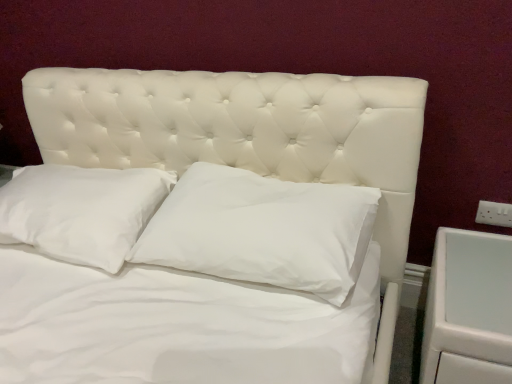
In order to face white soft pillow at center, acting as the 1th pillow starting from the left, should I rotate leftwards or rightwards?

To face it directly, rotate left by 24.126 degrees.

This screenshot has width=512, height=384. Describe the element at coordinates (262, 230) in the screenshot. I see `white cotton pillow at center, which ranks as the first pillow in right-to-left order` at that location.

In order to face white plastic electric outlet at right, should I rotate leftwards or rightwards?

To align with it, rotate right about 29.883°.

This screenshot has width=512, height=384. What do you see at coordinates (468, 309) in the screenshot?
I see `white glossy drawer at right` at bounding box center [468, 309].

Identify the location of white soft pillow at center, arranged as the 2th pillow when viewed from the right. This screenshot has height=384, width=512. (81, 211).

Is white glossy drawer at right further to camera compared to white soft pillow at center, acting as the 1th pillow starting from the left?

That is False.

Which point is more distant from viewer, (455, 276) or (82, 212)?

The point (82, 212) is behind.

From a real-world perspective, is white glossy drawer at right located beneath white soft pillow at center, arranged as the 2th pillow when viewed from the right?

Indeed, from a real-world perspective, white glossy drawer at right is positioned beneath white soft pillow at center, arranged as the 2th pillow when viewed from the right.

In the scene shown: Measure the distance from white glossy drawer at right to white soft pillow at center, arranged as the 2th pillow when viewed from the right.

white glossy drawer at right and white soft pillow at center, arranged as the 2th pillow when viewed from the right, are 3.38 feet apart from each other.

From the image's perspective, which one is positioned higher, white cotton pillow at center, which ranks as the first pillow in right-to-left order, or white plastic electric outlet at right?

white plastic electric outlet at right is shown above in the image.

How different are the orientations of white cotton pillow at center, which is the second pillow from left to right, and white plastic electric outlet at right in degrees?

They differ by 1.69 degrees in their facing directions.

Would you consider white cotton pillow at center, which is the second pillow from left to right, to be distant from white plastic electric outlet at right?

No, white cotton pillow at center, which is the second pillow from left to right, is not far from white plastic electric outlet at right.

Does point (366, 201) come in front of point (504, 203)?

Yes, it is.

Between white plastic electric outlet at right and white glossy drawer at right, which one has smaller width?

white plastic electric outlet at right is thinner.

Looking at this image, would you say white glossy drawer at right is part of white plastic electric outlet at right's contents?

Result: No, white glossy drawer at right is located outside of white plastic electric outlet at right.

Does white plastic electric outlet at right have a greater height compared to white glossy drawer at right?

Incorrect, the height of white plastic electric outlet at right is not larger of that of white glossy drawer at right.

From a real-world perspective, who is located higher, white plastic electric outlet at right or white glossy drawer at right?

From a 3D spatial view, white plastic electric outlet at right is above.

From a real-world perspective, between white soft pillow at center, acting as the 1th pillow starting from the left, and white glossy drawer at right, who is vertically higher?

white soft pillow at center, acting as the 1th pillow starting from the left, from a real-world perspective.

Based on the photo, is there a large distance between white soft pillow at center, arranged as the 2th pillow when viewed from the right, and white glossy drawer at right?

white soft pillow at center, arranged as the 2th pillow when viewed from the right, is far away from white glossy drawer at right.

Between white soft pillow at center, arranged as the 2th pillow when viewed from the right, and white glossy drawer at right, which one has more height?

white glossy drawer at right.

Considering the positions of points (152, 204) and (456, 339), is point (152, 204) closer to camera compared to point (456, 339)?

No.

Relative to white plastic electric outlet at right, is white glossy drawer at right in front or behind?

In the image, white glossy drawer at right appears in front of white plastic electric outlet at right.

Is white glossy drawer at right positioned far away from white plastic electric outlet at right?

No, white glossy drawer at right is not far from white plastic electric outlet at right.

Identify the location of dresser below the white plastic electric outlet at right (from a real-world perspective). The height and width of the screenshot is (384, 512). (468, 309).

How many degrees apart are the facing directions of white glossy drawer at right and white plastic electric outlet at right?

0.925 degrees separate the facing orientations of white glossy drawer at right and white plastic electric outlet at right.

Is point (118, 214) positioned after point (162, 229)?

Yes.

Which object is further away from the camera taking this photo, white soft pillow at center, acting as the 1th pillow starting from the left, or white cotton pillow at center, which ranks as the first pillow in right-to-left order?

white soft pillow at center, acting as the 1th pillow starting from the left, is further away from the camera.

From a real-world perspective, does white soft pillow at center, acting as the 1th pillow starting from the left, stand above white cotton pillow at center, which is the second pillow from left to right?

No, from a real-world perspective, white soft pillow at center, acting as the 1th pillow starting from the left, is not above white cotton pillow at center, which is the second pillow from left to right.

From the image's perspective, would you say white cotton pillow at center, which is the second pillow from left to right, is shown under white glossy drawer at right?

Incorrect, from the image's perspective, white cotton pillow at center, which is the second pillow from left to right, is higher than white glossy drawer at right.

Considering the sizes of objects white cotton pillow at center, which ranks as the first pillow in right-to-left order, and white glossy drawer at right in the image provided, who is smaller, white cotton pillow at center, which ranks as the first pillow in right-to-left order, or white glossy drawer at right?

With smaller size is white cotton pillow at center, which ranks as the first pillow in right-to-left order.

Is white cotton pillow at center, which ranks as the first pillow in right-to-left order, situated inside white glossy drawer at right or outside?

white cotton pillow at center, which ranks as the first pillow in right-to-left order, cannot be found inside white glossy drawer at right.

Who is taller, white cotton pillow at center, which ranks as the first pillow in right-to-left order, or white glossy drawer at right?

Standing taller between the two is white glossy drawer at right.

From a real-world perspective, which pillow is the 1st one above the white glossy drawer at right? Please provide its 2D coordinates.

[(81, 211)]

Where is `electric outlet behind the white cotton pillow at center, which is the second pillow from left to right`? The height and width of the screenshot is (384, 512). electric outlet behind the white cotton pillow at center, which is the second pillow from left to right is located at coordinates (494, 214).

Which object lies further to the anchor point white soft pillow at center, arranged as the 2th pillow when viewed from the right, white cotton pillow at center, which is the second pillow from left to right, or white glossy drawer at right?

Among the two, white glossy drawer at right is located further to white soft pillow at center, arranged as the 2th pillow when viewed from the right.

Estimate the real-world distances between objects in this image. Which object is closer to white cotton pillow at center, which ranks as the first pillow in right-to-left order, white soft pillow at center, arranged as the 2th pillow when viewed from the right, or white plastic electric outlet at right?

white soft pillow at center, arranged as the 2th pillow when viewed from the right, is closer to white cotton pillow at center, which ranks as the first pillow in right-to-left order.

Looking at this image, when comparing their distances from white cotton pillow at center, which is the second pillow from left to right, does white plastic electric outlet at right or white soft pillow at center, acting as the 1th pillow starting from the left, seem further?

Based on the image, white plastic electric outlet at right appears to be further to white cotton pillow at center, which is the second pillow from left to right.

Looking at the image, which one is located further to white plastic electric outlet at right, white soft pillow at center, acting as the 1th pillow starting from the left, or white cotton pillow at center, which is the second pillow from left to right?

Based on the image, white soft pillow at center, acting as the 1th pillow starting from the left, appears to be further to white plastic electric outlet at right.

Based on their spatial positions, is white soft pillow at center, arranged as the 2th pillow when viewed from the right, or white plastic electric outlet at right closer to white glossy drawer at right?

white plastic electric outlet at right is positioned closer to the anchor white glossy drawer at right.

Based on their spatial positions, is white soft pillow at center, acting as the 1th pillow starting from the left, or white glossy drawer at right closer to white plastic electric outlet at right?

Among the two, white glossy drawer at right is located nearer to white plastic electric outlet at right.

Which object lies nearer to the anchor point white glossy drawer at right, white cotton pillow at center, which is the second pillow from left to right, or white plastic electric outlet at right?

Based on the image, white plastic electric outlet at right appears to be nearer to white glossy drawer at right.

Which object lies nearer to the anchor point white glossy drawer at right, white cotton pillow at center, which ranks as the first pillow in right-to-left order, or white soft pillow at center, acting as the 1th pillow starting from the left?

The object closer to white glossy drawer at right is white cotton pillow at center, which ranks as the first pillow in right-to-left order.

Identify the location of dresser between white cotton pillow at center, which is the second pillow from left to right, and white plastic electric outlet at right. (468, 309).

What are the coordinates of `pillow between white soft pillow at center, acting as the 1th pillow starting from the left, and white plastic electric outlet at right from left to right` in the screenshot? It's located at (262, 230).

Where is `pillow between white soft pillow at center, acting as the 1th pillow starting from the left, and white glossy drawer at right, in the horizontal direction`? The height and width of the screenshot is (384, 512). pillow between white soft pillow at center, acting as the 1th pillow starting from the left, and white glossy drawer at right, in the horizontal direction is located at coordinates (262, 230).

Identify the location of dresser between white soft pillow at center, acting as the 1th pillow starting from the left, and white plastic electric outlet at right. (468, 309).